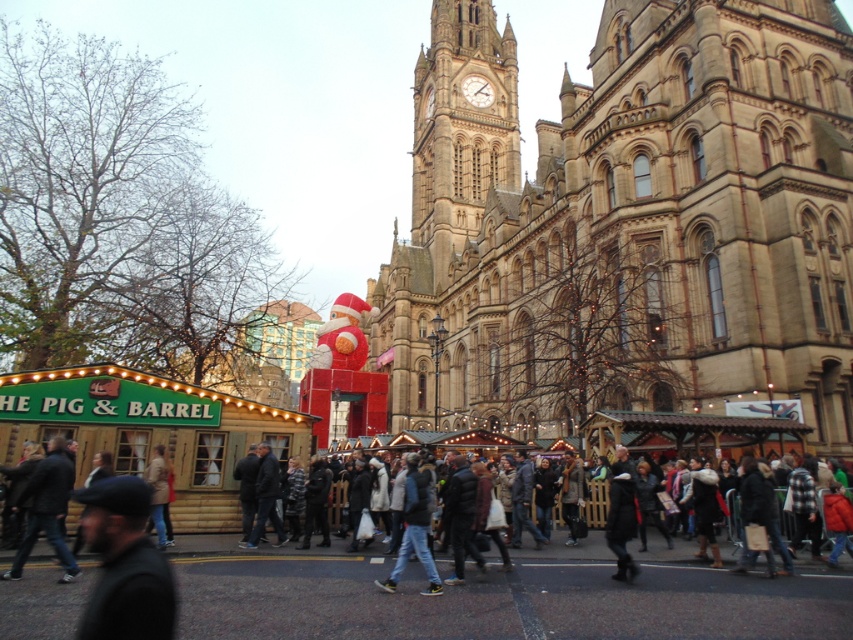
You are a street performer who wants to place a 1.2 meter wide mat in the center of the street. You see the jeans at center and the light brown leather jacket at lower left. Can you determine if the space between them is wide enough to fit the mat?

The jeans at center is wider than the light brown leather jacket at lower left, so the space between them may be sufficient to fit the 1.2 meter wide mat. However, without exact measurements of the distance between them, it is uncertain. Please check the actual space before placing the mat.